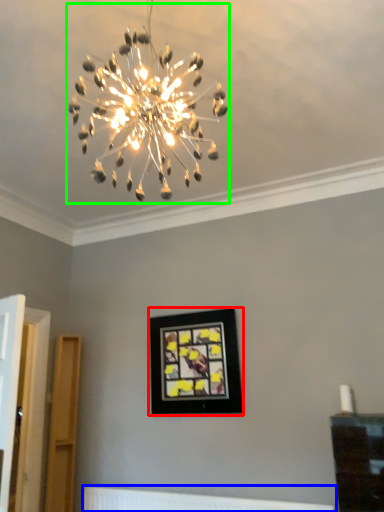
Question: Based on their relative distances, which object is farther from picture frame (highlighted by a red box)? Choose from radiator (highlighted by a blue box) and lamp (highlighted by a green box).

Choices:
 (A) radiator
 (B) lamp

Answer: (B)